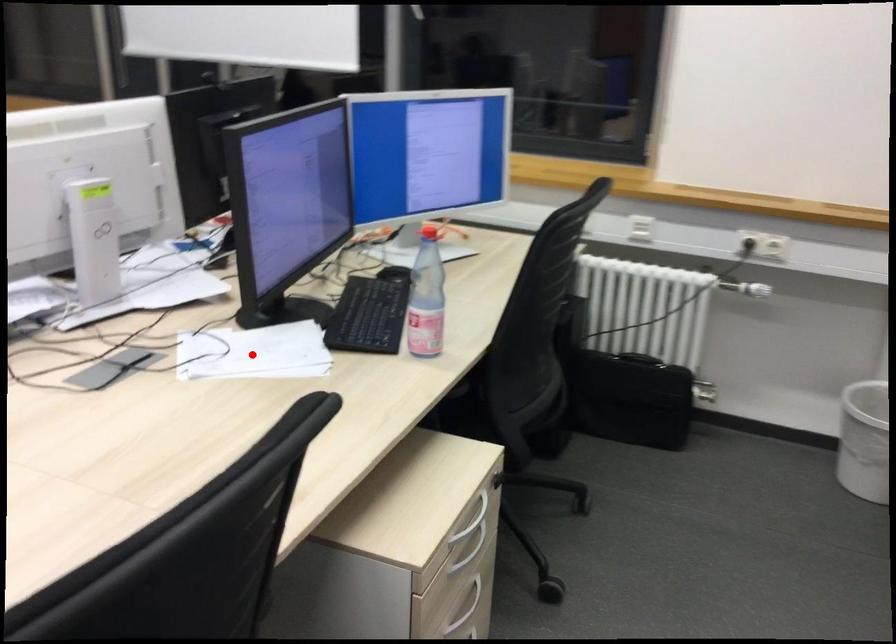
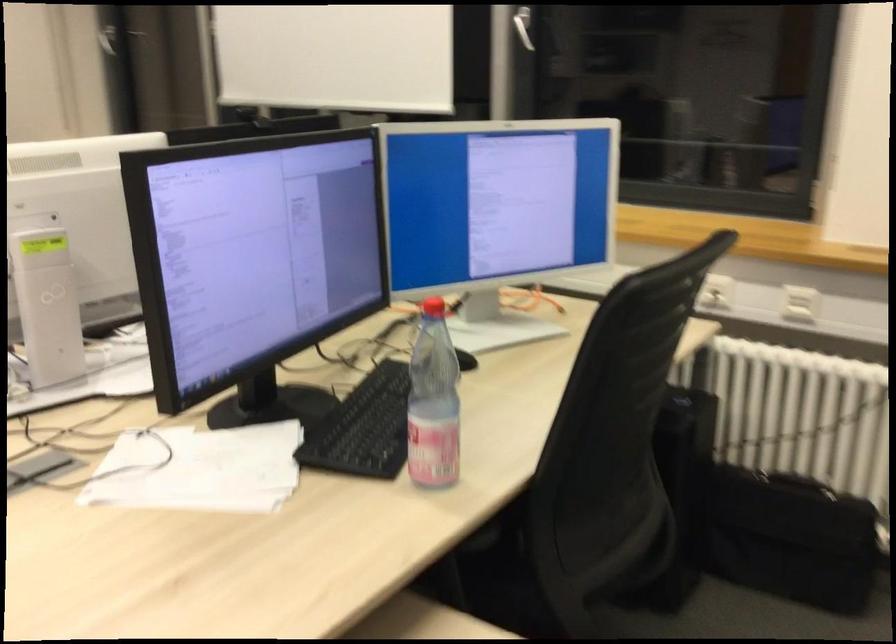
Question: I am providing you with two images of the same scene from different viewpoints. In image1, a red point is highlighted. Considering the same 3D point in image2, which of the following is correct?

Choices:
 (A) It is closer
 (B) It is farther

Answer: (A)